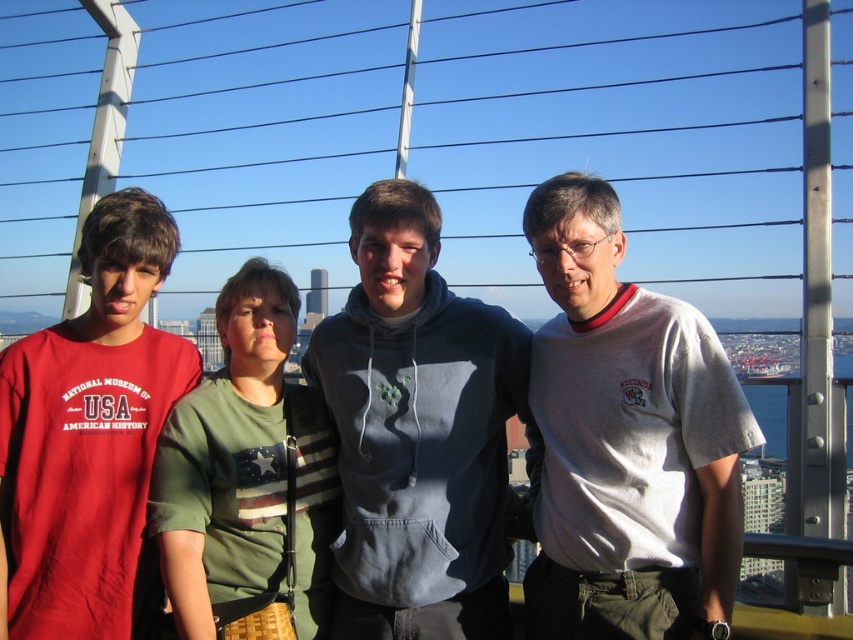
Is point (679, 524) closer to camera compared to point (165, 520)?

Yes.

Does white cotton t-shirt at center appear on the left side of green fabric shirt at center?

Incorrect, white cotton t-shirt at center is not on the left side of green fabric shirt at center.

Who is more distant from viewer, (x=604, y=340) or (x=183, y=540)?

Point (x=604, y=340)

At what (x,y) coordinates should I click in order to perform the action: click on white cotton t-shirt at center. Please return your answer as a coordinate pair (x, y). Looking at the image, I should click on (627, 440).

Is white cotton t-shirt at center thinner than gray hoodie at center?

Yes.

What do you see at coordinates (627, 440) in the screenshot? Image resolution: width=853 pixels, height=640 pixels. I see `white cotton t-shirt at center` at bounding box center [627, 440].

Which is in front, point (654, 572) or point (399, 449)?

Positioned in front is point (654, 572).

The width and height of the screenshot is (853, 640). I want to click on white cotton t-shirt at center, so click(x=627, y=440).

Between point (337, 634) and point (206, 563), which one is positioned behind?

The point (337, 634) is more distant.

Is point (479, 573) more distant than point (312, 528)?

No, it is not.

Is point (363, 240) behind point (157, 513)?

Yes, it is behind point (157, 513).

The image size is (853, 640). In order to click on gray hoodie at center in this screenshot , I will do `click(418, 433)`.